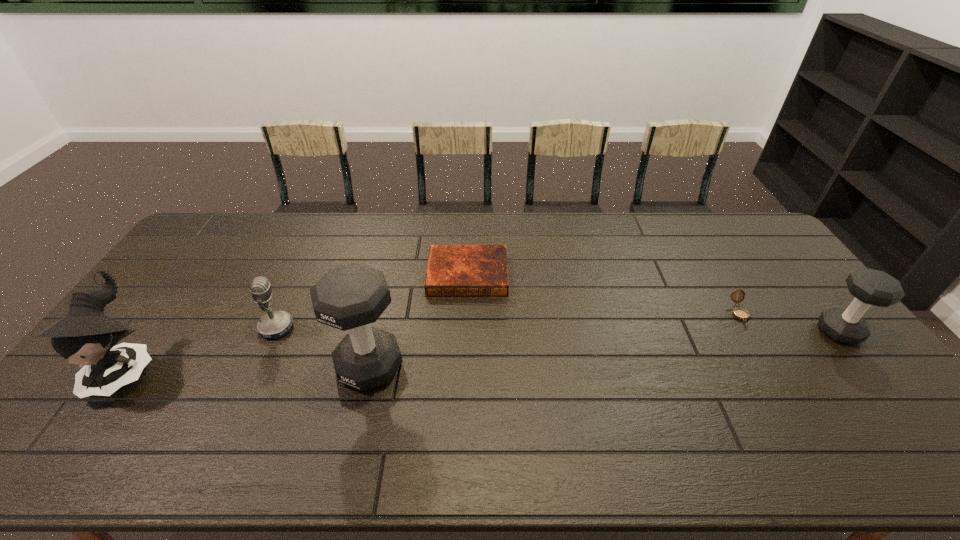
This screenshot has width=960, height=540. I want to click on object located at the near left corner, so click(86, 336).

Identify the location of vacant region at the far edge of the desktop. This screenshot has width=960, height=540. [339, 230].

In the image, there is a desktop. At what (x,y) coordinates should I click in order to perform the action: click on free space at the left edge. Please return your answer as a coordinate pair (x, y). Looking at the image, I should click on (199, 297).

Locate an element on the screen. This screenshot has width=960, height=540. free space at the right edge of the desktop is located at coordinates point(762,281).

Find the location of a particular element. The image size is (960, 540). vacant space at the far left corner of the desktop is located at coordinates (227, 237).

Identify the location of free space at the far right corner of the desktop. Image resolution: width=960 pixels, height=540 pixels. (732, 232).

The height and width of the screenshot is (540, 960). Find the location of `free space that is in between the third object from left to right and the right dumbbell`. free space that is in between the third object from left to right and the right dumbbell is located at coordinates (605, 349).

Where is `vacant area that lies between the doll and the fourth object from left to right`? The height and width of the screenshot is (540, 960). vacant area that lies between the doll and the fourth object from left to right is located at coordinates tap(298, 321).

Where is `vacant space that's between the fifth tallest object and the fourth object from right to left`? The height and width of the screenshot is (540, 960). vacant space that's between the fifth tallest object and the fourth object from right to left is located at coordinates (554, 340).

At what (x,y) coordinates should I click in order to perform the action: click on free space between the farthest object and the second tallest object. Please return your answer as a coordinate pair (x, y). Looking at the image, I should click on click(x=298, y=321).